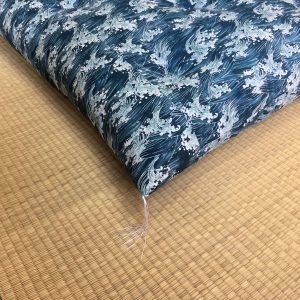
Locate an element on the screen. This screenshot has width=300, height=300. shadow from pillow is located at coordinates (51, 91).